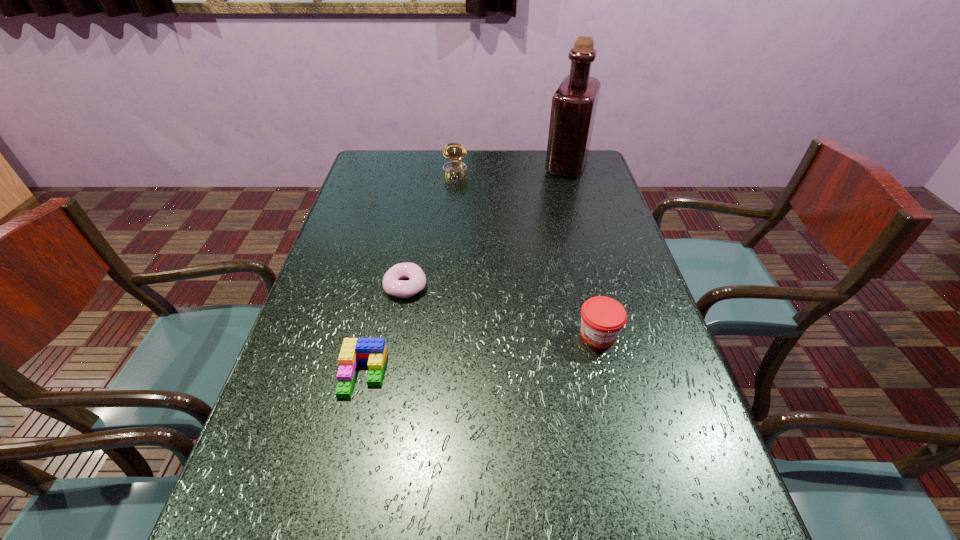
I want to click on the tallest object, so click(x=574, y=104).

Locate an element on the screen. the second tallest object is located at coordinates (454, 151).

The height and width of the screenshot is (540, 960). I want to click on the third object from left to right, so 454,151.

Find the location of a particular element. The height and width of the screenshot is (540, 960). the fourth farthest object is located at coordinates (602, 318).

Locate an element on the screen. This screenshot has width=960, height=540. the third shortest object is located at coordinates (602, 318).

Locate an element on the screen. the fourth tallest object is located at coordinates (372, 351).

This screenshot has width=960, height=540. What are the coordinates of `Lego` in the screenshot? It's located at (372, 351).

Identify the location of the third nearest object. (392, 284).

Image resolution: width=960 pixels, height=540 pixels. I want to click on the shortest object, so click(x=392, y=284).

At what (x,y) coordinates should I click in order to perform the action: click on vacant space positioned on the left of the tallest object. Please return your answer as a coordinate pair (x, y). This screenshot has width=960, height=540. Looking at the image, I should click on [481, 165].